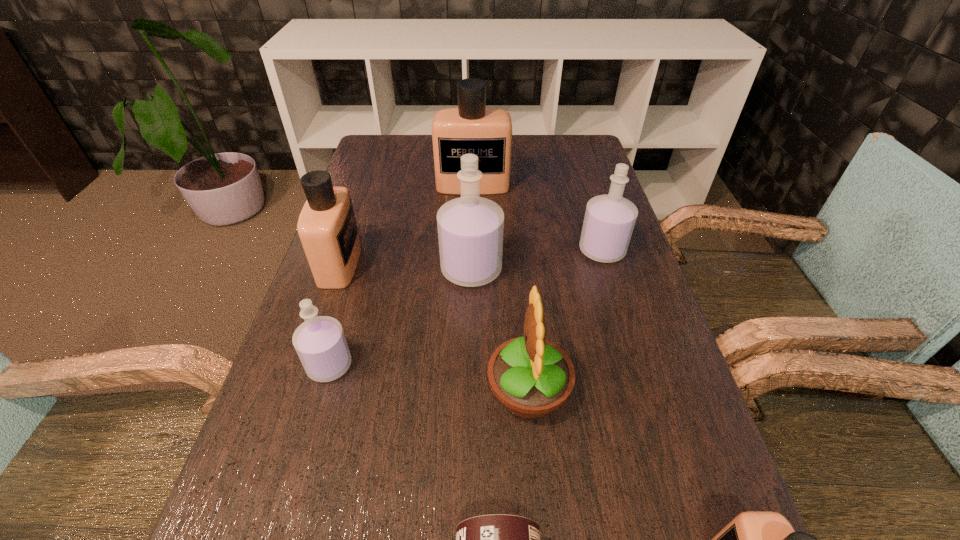
This screenshot has width=960, height=540. I want to click on free space at the right edge of the desktop, so click(604, 325).

This screenshot has width=960, height=540. What are the coordinates of `free space at the far left corner of the desktop` in the screenshot? It's located at (396, 164).

In the image, there is a desktop. Identify the location of free space at the far right corner. (571, 135).

At what (x,y) coordinates should I click in order to perform the action: click on free space between the second smallest beige perfume and the farthest object. Please return your answer as a coordinate pair (x, y). The image size is (960, 540). Looking at the image, I should click on (406, 225).

Where is `vacant point located between the biggest purple perfume and the fifth farthest perfume`? This screenshot has width=960, height=540. vacant point located between the biggest purple perfume and the fifth farthest perfume is located at coordinates (400, 318).

What are the coordinates of `free point between the second nearest beige perfume and the second purple perfume from left to right` in the screenshot? It's located at (406, 267).

In order to click on free point between the sunflower and the second purple perfume from right to left in this screenshot , I will do `click(500, 329)`.

You are a GUI agent. You are given a task and a screenshot of the screen. Output one action in this format:
    pyautogui.click(x=<x>, y=<y>)
    Task: Click on the vacant area that lies between the second smallest purple perfume and the biggest beige perfume
    
    Given the screenshot: What is the action you would take?
    pyautogui.click(x=538, y=218)

Locate an element on the screen. This screenshot has width=960, height=540. vacant space that is in between the leftmost purple perfume and the second biggest purple perfume is located at coordinates (466, 308).

Where is `object that is the fourth closest to the yellow sunflower`? The width and height of the screenshot is (960, 540). object that is the fourth closest to the yellow sunflower is located at coordinates pos(320,343).